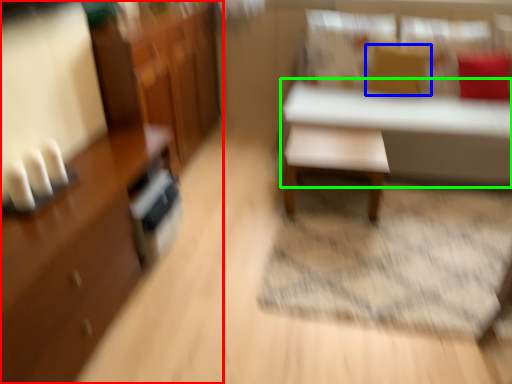
Question: Which is nearer to the cabinetry (highlighted by a red box)? pillow (highlighted by a blue box) or table (highlighted by a green box).

Choices:
 (A) pillow
 (B) table

Answer: (B)